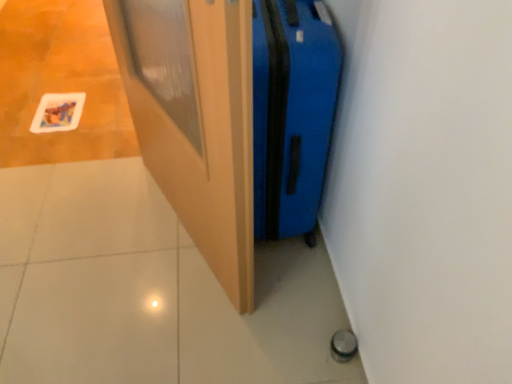
Identify the location of vacant space positioned to the left of wooden door at center. Image resolution: width=512 pixels, height=384 pixels. (88, 228).